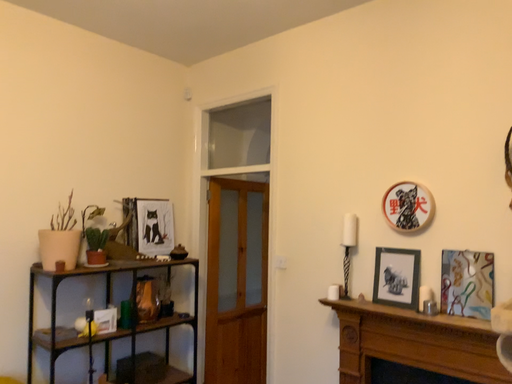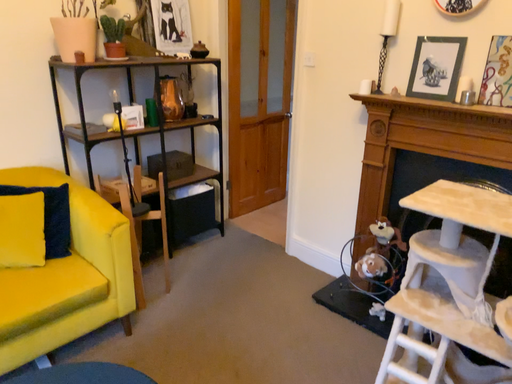
Question: How did the camera likely rotate when shooting the video?

Choices:
 (A) rotated upward
 (B) rotated downward

Answer: (B)